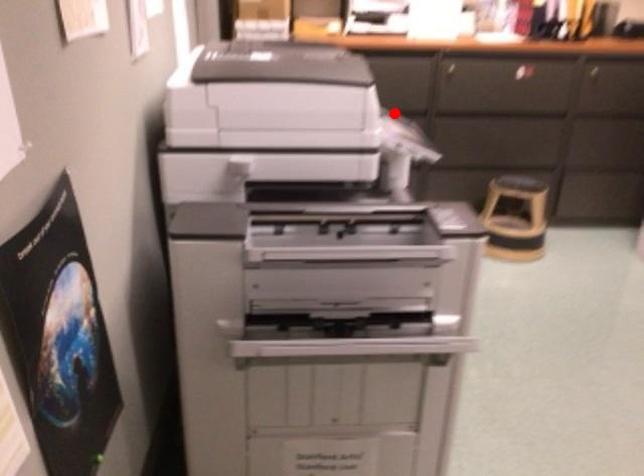
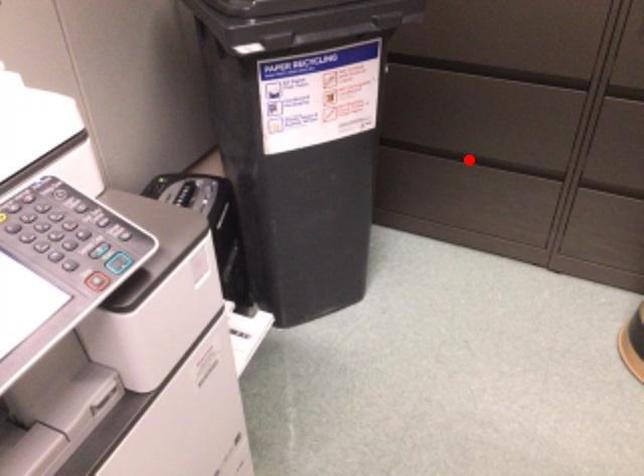
I am providing you with two images of the same scene from different viewpoints. A red point is marked on the first image and another point is marked on the second image. Does the point marked in image1 correspond to the same location as the one in image2?

No